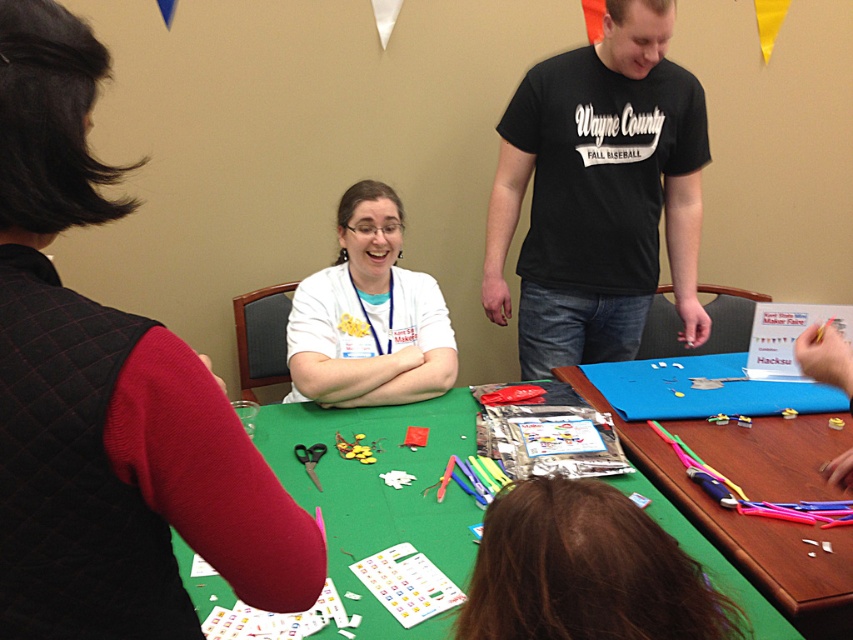
You are a photographer standing 1.5 meters away from the green fabric table at center. You want to take a closeup shot of the table without moving closer. Can you do it using a standard zoom lens with a maximum zoom of 200mm? Assume the camera sensor is full frame.

The green fabric table at center is 1.06 meters from camera. Since you are standing 1.5 meters away, the distance is greater than the table to camera distance. Wait, perhaps I need to clarify. Hmm, the object description says the table is 1.06 meters from the camera. If the photographer is 1.5 meters away, that might mean the total distance is 1.5m, but the table is only 1.06m? That doesn not make sense. Maybe there is a misunderstanding here. Let me recheck the problem. The question states the photographer

What is located at the point with coordinates (x=599, y=193)?

The black cotton t shirt at upper center is located at point (x=599, y=193).

You are standing in the room and want to pick up an item from the green fabric table at lower center. However, there is a white matte shirt at center in your way. Can you reach the table without moving the person wearing the shirt?

The green fabric table at lower center is closer to the viewer than the white matte shirt at center, so yes, you can reach the table without moving the person wearing the shirt because the table is nearer to you.